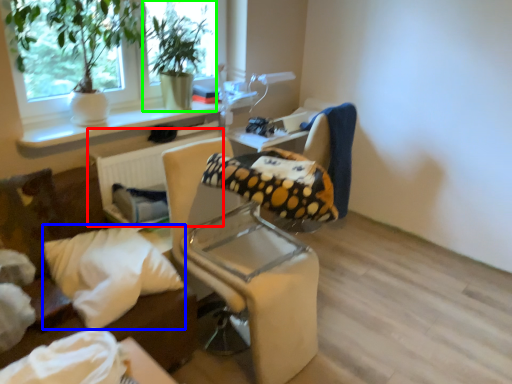
Question: Which object is the farthest from radiator (highlighted by a red box)? Choose among these: pillow (highlighted by a blue box) or houseplant (highlighted by a green box).

Choices:
 (A) pillow
 (B) houseplant

Answer: (A)